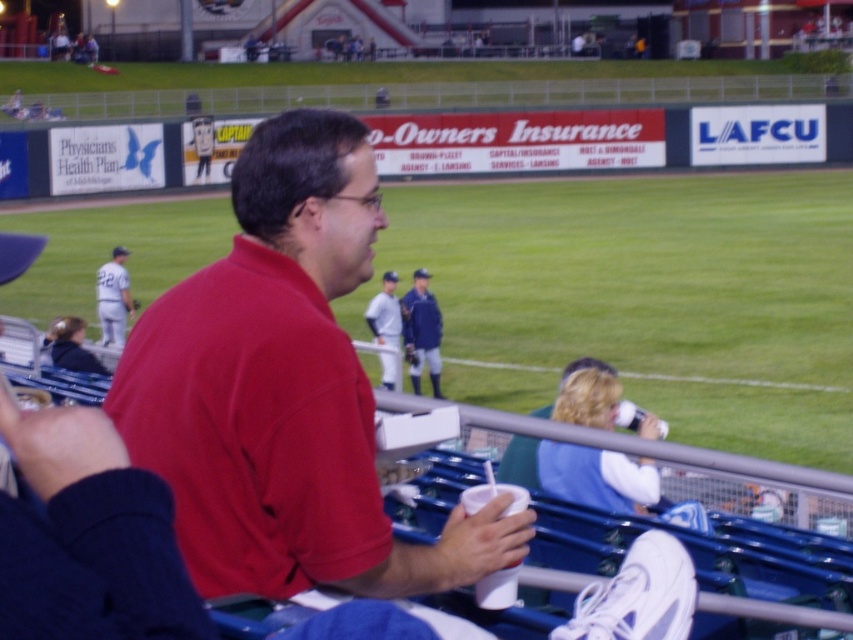
Question: Which object appears farthest from the camera in this image?

Choices:
 (A) white jersey at center
 (B) white uniform at left
 (C) blue fabric jacket at center
 (D) matte red shirt at center

Answer: (B)

Question: In this image, where is matte red shirt at center located relative to blue fabric jacket at center?

Choices:
 (A) left
 (B) right

Answer: (B)

Question: Does matte red shirt at center appear over blue fabric jacket at center?

Choices:
 (A) no
 (B) yes

Answer: (B)

Question: Which of the following is the farthest from the observer?

Choices:
 (A) (380, 296)
 (B) (405, 340)
 (C) (120, 257)
 (D) (378, 572)

Answer: (C)

Question: Is blue fabric jacket at center behind white jersey at center?

Choices:
 (A) yes
 (B) no

Answer: (A)

Question: Which point is farther from the camera taking this photo?

Choices:
 (A) (393, 296)
 (B) (177, 336)

Answer: (A)